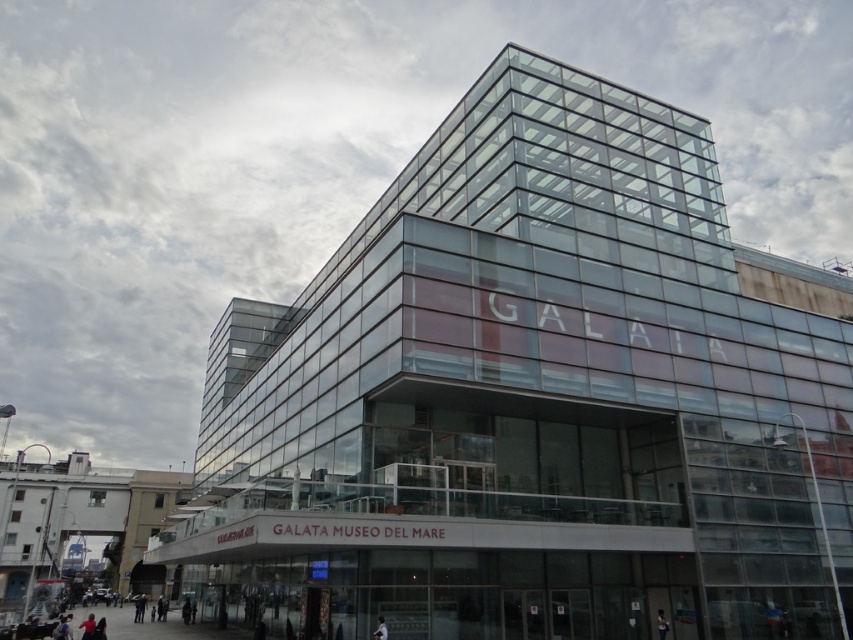
You are a fashion designer observing the image of the modern glass building labeled GALATA. You notice two items at the lower center of the scene. Which item has a greater width between the dark blue jeans at lower center and the dark gray fabric jacket at lower center?

The dark blue jeans at lower center has a greater width than the dark gray fabric jacket at lower center according to the description provided.

You are a fashion designer observing a person wearing dark blue jeans at lower center and dark gray jacket at lower center. Which clothing item takes up more space on the person?

The dark blue jeans at lower center takes up more space on the person because it is larger in size than the dark gray jacket at lower center.